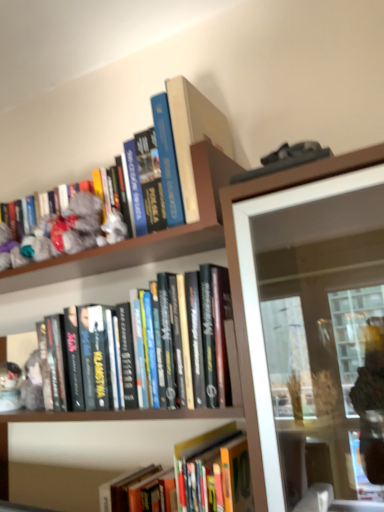
Question: Is hardcover book at upper center, which appears as the 2th book when viewed from the top, positioned behind hardcover books at center, acting as the 3th book starting from the top?

Choices:
 (A) yes
 (B) no

Answer: (A)

Question: Does hardcover book at upper center, which appears as the 2th book when viewed from the top, turn towards hardcover books at center, acting as the 3th book starting from the top?

Choices:
 (A) no
 (B) yes

Answer: (A)

Question: Is hardcover book at upper center, which appears as the 2th book when viewed from the top, positioned beyond the bounds of hardcover books at center, acting as the 3th book starting from the top?

Choices:
 (A) yes
 (B) no

Answer: (A)

Question: Considering the relative positions of hardcover book at upper center, the 3th book from the bottom, and hardcover books at center, acting as the 3th book starting from the top, in the image provided, is hardcover book at upper center, the 3th book from the bottom, to the right of hardcover books at center, acting as the 3th book starting from the top, from the viewer's perspective?

Choices:
 (A) no
 (B) yes

Answer: (A)

Question: Is hardcover book at upper center, the 3th book from the bottom, far from hardcover books at center, acting as the 3th book starting from the top?

Choices:
 (A) yes
 (B) no

Answer: (B)

Question: Relative to hardcover books at center, acting as the 3th book starting from the top, is hardcover book at upper center, which is the 4th book in bottom-to-top order, in front or behind?

Choices:
 (A) front
 (B) behind

Answer: (B)

Question: Based on their positions, is hardcover book at upper center, the 1th book when ordered from top to bottom, located to the left or right of hardcover books at center, acting as the 3th book starting from the top?

Choices:
 (A) right
 (B) left

Answer: (A)

Question: In terms of width, does hardcover book at upper center, the 1th book when ordered from top to bottom, look wider or thinner when compared to hardcover books at center, acting as the 3th book starting from the top?

Choices:
 (A) thin
 (B) wide

Answer: (A)

Question: Considering the positions of point click(x=203, y=111) and point click(x=104, y=294), is point click(x=203, y=111) closer or farther from the camera than point click(x=104, y=294)?

Choices:
 (A) closer
 (B) farther

Answer: (A)

Question: From a real-world perspective, is hardcover book at center, which is the fourth book from top to bottom, above or below fuzzy fabric toy at upper left?

Choices:
 (A) below
 (B) above

Answer: (A)

Question: Choose the correct answer: Is hardcover book at center, which is the first book from bottom to top, inside fuzzy fabric toy at upper left or outside it?

Choices:
 (A) inside
 (B) outside

Answer: (B)

Question: From the image's perspective, relative to fuzzy fabric toy at upper left, is hardcover book at center, which is the first book from bottom to top, above or below?

Choices:
 (A) above
 (B) below

Answer: (B)

Question: In terms of height, does hardcover book at center, which is the fourth book from top to bottom, look taller or shorter compared to fuzzy fabric toy at upper left?

Choices:
 (A) tall
 (B) short

Answer: (A)

Question: Considering the positions of point (38, 308) and point (100, 484), is point (38, 308) closer or farther from the camera than point (100, 484)?

Choices:
 (A) farther
 (B) closer

Answer: (A)

Question: Looking at their shapes, would you say hardcover books at center, acting as the 3th book starting from the top, is wider or thinner than hardcover book at center, which is the first book from bottom to top?

Choices:
 (A) wide
 (B) thin

Answer: (B)